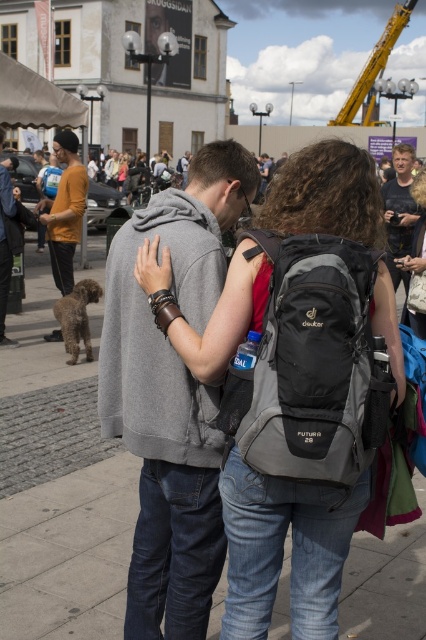
You are a photographer trying to capture the scene. You notice a point at coordinates (296,381) in the image. What object is located at this point?

The point at coordinates (296,381) corresponds to the denim backpack at center.

You are a photographer at the event and want to capture a clear shot of both the matte yellow shirt at left and the yellow metallic crane at upper right. However, the crane is partially hidden by the shirt. Can you adjust your position to ensure both are fully visible?

The matte yellow shirt at left is in front of the yellow metallic crane at upper right. To ensure both are fully visible, you should move to a position where the shirt is no longer blocking the crane, perhaps by shifting your angle or moving around the obstruction.